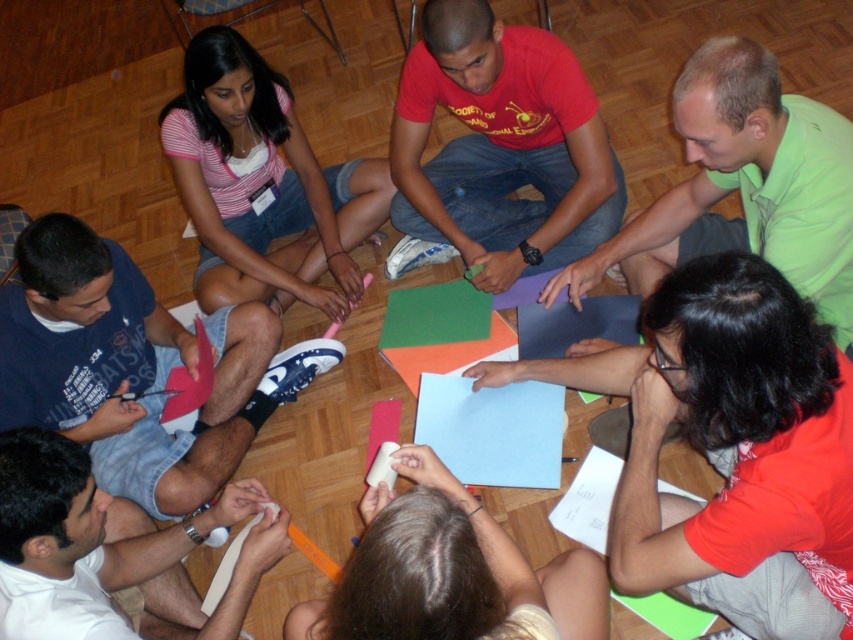
You are a photographer standing in front of the scene. You want to take a photo of both the green matte shirt at upper right and the smooth white paper at lower center in the same frame. Given the camera you have can capture objects within a 1 meter range, will both objects fit in the frame?

The green matte shirt at upper right and smooth white paper at lower center are 78.09 centimeters apart from each other. Since 78.09 centimeters is less than 1 meter, both objects will fit within the camera frame.